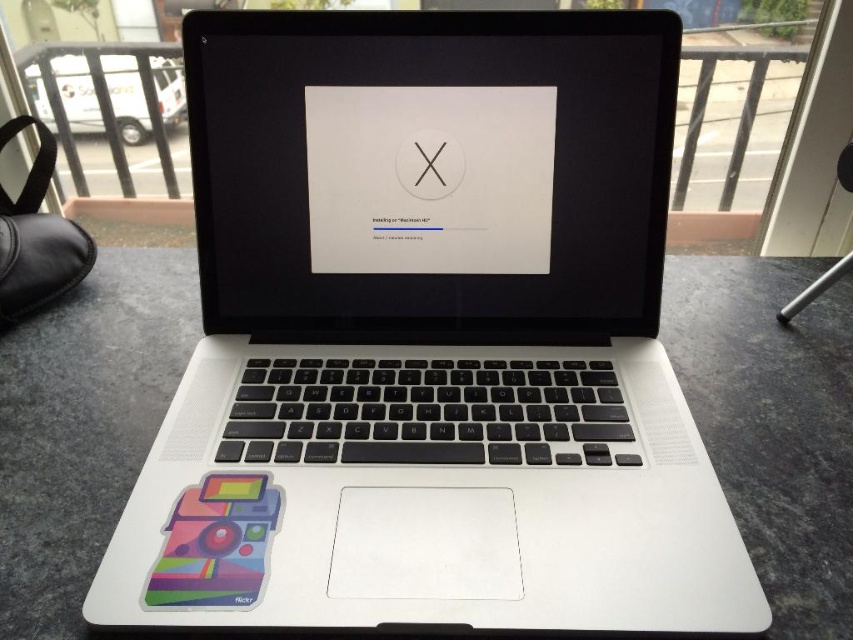
You are standing 22.64 inches away from the point at coordinates point (589, 180). Can you see the white van parked outside through the window behind the MacBook laptop?

Yes, the point at coordinates point (589, 180) is 22.64 inches away from the viewer, so you can see the white van parked outside through the window behind the MacBook laptop.

You are setting up a new MacBook and need to determine which part is bigger between the satin black screen at center and the black matte logo at center. Which one is larger?

The satin black screen at center is larger in size than the black matte logo at center.

You are setting up a new MacBook and want to place a multicolored glossy sticker at lower left and a black matte logo at center on the laptop. Considering their sizes, which one will have a greater height when placed?

The multicolored glossy sticker at lower left is much taller than the black matte logo at center, so it will have a greater height when placed.